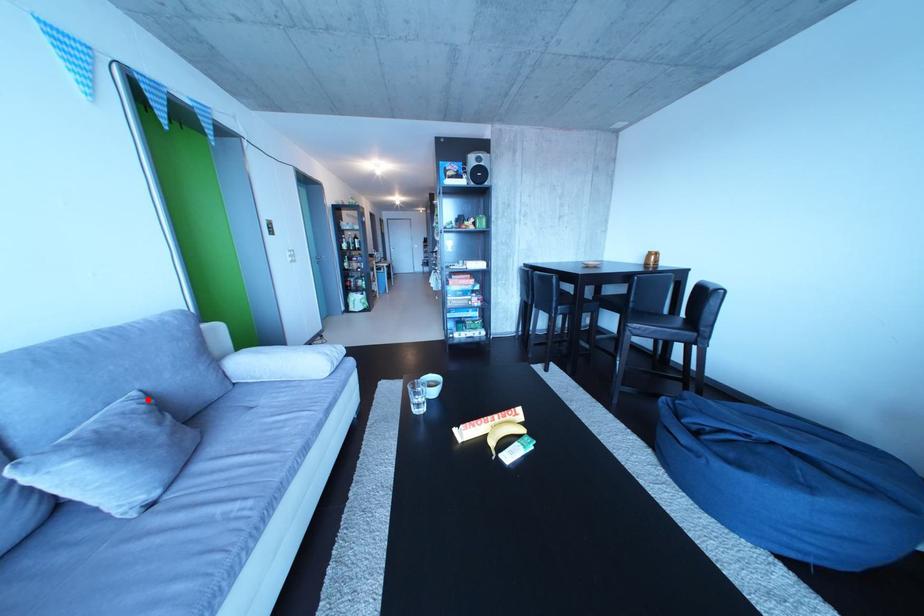
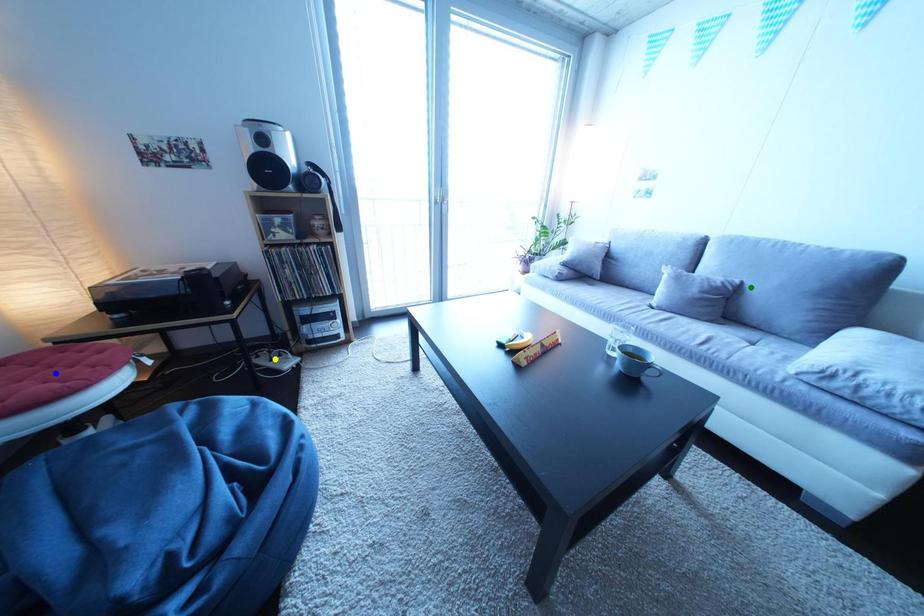
Question: I am providing you with two images of the same scene from different viewpoints. A red point is marked on the first image. You are given multiple points on the second image. Which mark in image 2 goes with the point in image 1?

Choices:
 (A) yellow point
 (B) blue point
 (C) green point

Answer: (C)